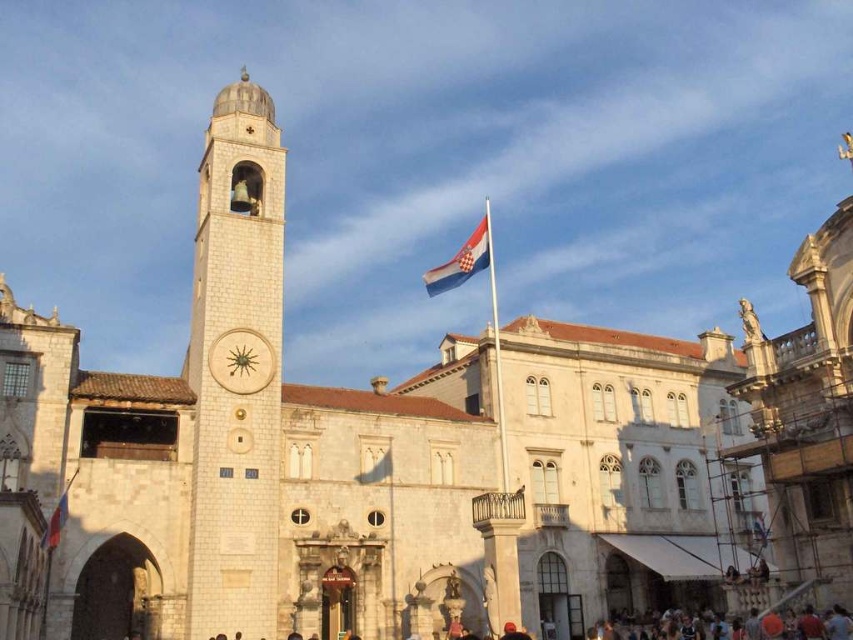
Question: Which point is farther to the camera?

Choices:
 (A) red fabric flag at lower left
 (B) white stone clock tower at center

Answer: (B)

Question: Can you confirm if white stone clock tower at center is bigger than blue and white striped flag at center?

Choices:
 (A) no
 (B) yes

Answer: (B)

Question: Does white stone clock tower at center appear on the right side of blue and white striped flag at center?

Choices:
 (A) yes
 (B) no

Answer: (B)

Question: Estimate the real-world distances between objects in this image. Which object is farther from the white stone clock tower at center?

Choices:
 (A) wooden clock at center
 (B) blue and white striped flag at center

Answer: (B)

Question: Does white stone clock tower at center have a lesser width compared to red fabric flag at lower left?

Choices:
 (A) yes
 (B) no

Answer: (B)

Question: Which of the following is the farthest from the observer?

Choices:
 (A) (230, 253)
 (B) (267, 362)

Answer: (A)